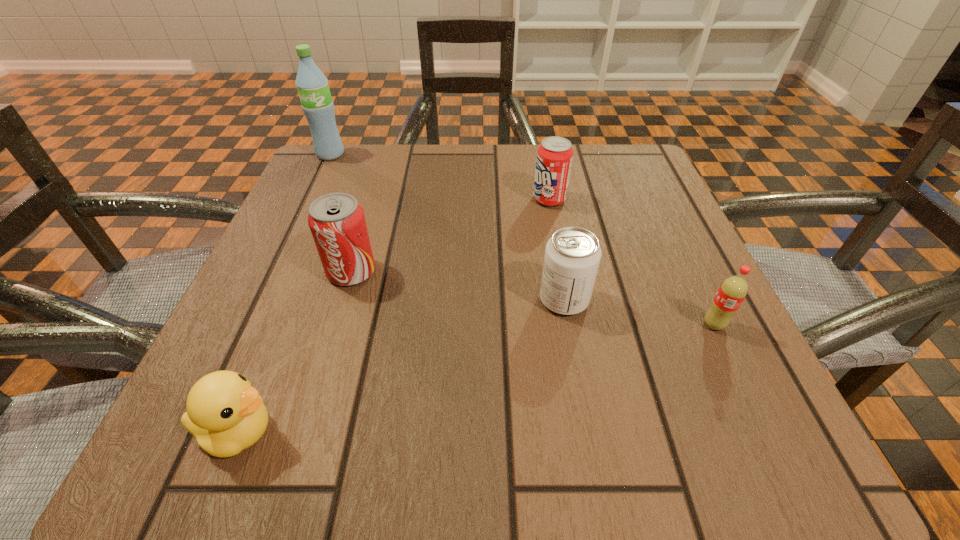
Locate an element on the screen. the tallest object is located at coordinates (312, 85).

Identify the location of the farthest object. The width and height of the screenshot is (960, 540). (x=312, y=85).

The width and height of the screenshot is (960, 540). Identify the location of the leftmost soda. (337, 222).

Locate an element on the screen. the farthest soda is located at coordinates (554, 157).

Find the location of a particular element. The image size is (960, 540). the rightmost object is located at coordinates (x=733, y=290).

Identify the location of duck. (225, 413).

The image size is (960, 540). Find the location of `free point located 0.180m on the right of the water bottle`. free point located 0.180m on the right of the water bottle is located at coordinates (423, 154).

This screenshot has width=960, height=540. I want to click on blank space located on the front of the leftmost soda, so click(x=333, y=333).

Find the location of `vacant region located on the surface of the second farthest object`. vacant region located on the surface of the second farthest object is located at coordinates [464, 199].

Identify the location of free space located on the surface of the second farthest object. (373, 199).